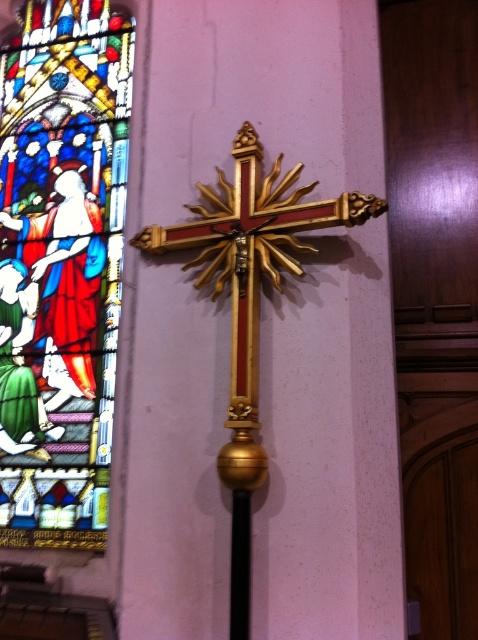
Is stained glass window at left shorter than gold polished crucifix at center?

Incorrect, stained glass window at left's height does not fall short of gold polished crucifix at center's.

Which is below, stained glass window at left or gold polished crucifix at center?

gold polished crucifix at center is below.

Which is in front, point (6, 54) or point (265, 452)?

Point (265, 452) is more forward.

Image resolution: width=478 pixels, height=640 pixels. I want to click on stained glass window at left, so click(x=61, y=268).